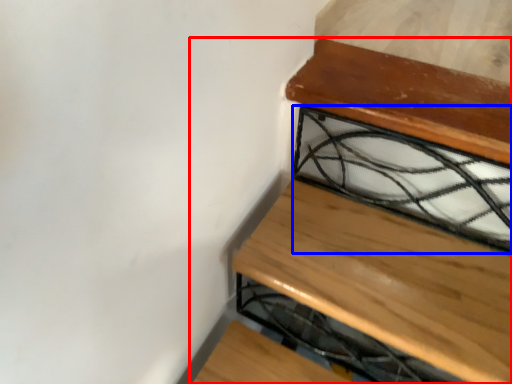
Question: Which object appears farthest to the camera in this image, furniture (highlighted by a red box) or glass window (highlighted by a blue box)?

Choices:
 (A) furniture
 (B) glass window

Answer: (B)